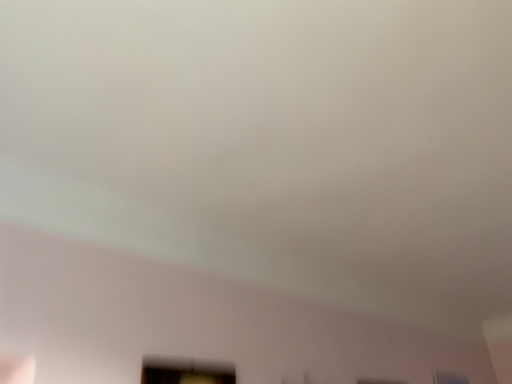
In order to face black glass window at lower center, should I rotate leftwards or rightwards?

Turn left by 8.154 degrees to look at black glass window at lower center.

The image size is (512, 384). Describe the element at coordinates (185, 372) in the screenshot. I see `black glass window at lower center` at that location.

Locate an element on the screen. black glass window at lower center is located at coordinates (185, 372).

From the picture: Measure the distance between black glass window at lower center and camera.

black glass window at lower center is 1.24 meters away from camera.

The height and width of the screenshot is (384, 512). I want to click on black glass window at lower center, so click(x=185, y=372).